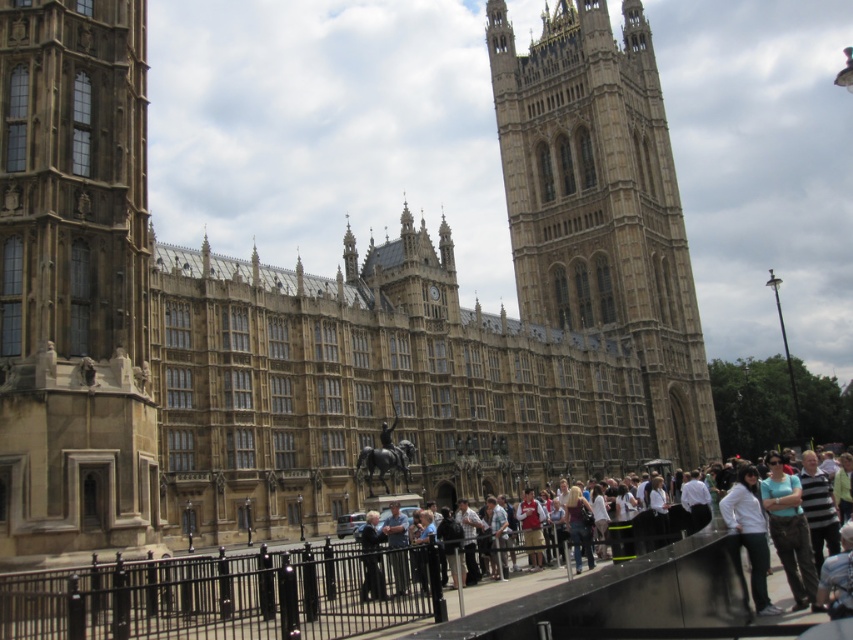
Question: Can you confirm if light brown fabric crowd at center is thinner than denim pants at lower right?

Choices:
 (A) no
 (B) yes

Answer: (B)

Question: Which point is closer to the camera?

Choices:
 (A) black metal fence at lower center
 (B) denim pants at lower right
 (C) light brown fabric crowd at center
 (D) brown stone tower at left

Answer: (C)

Question: Among these points, which one is farthest from the camera?

Choices:
 (A) (471, 621)
 (B) (113, 128)
 (C) (666, 339)

Answer: (C)

Question: Does golden stone tower at center have a greater width compared to denim pants at lower right?

Choices:
 (A) no
 (B) yes

Answer: (A)

Question: Does brown stone tower at left have a greater width compared to denim pants at lower right?

Choices:
 (A) no
 (B) yes

Answer: (A)

Question: Which object is farther from the camera taking this photo?

Choices:
 (A) brown stone tower at left
 (B) golden stone tower at center

Answer: (B)